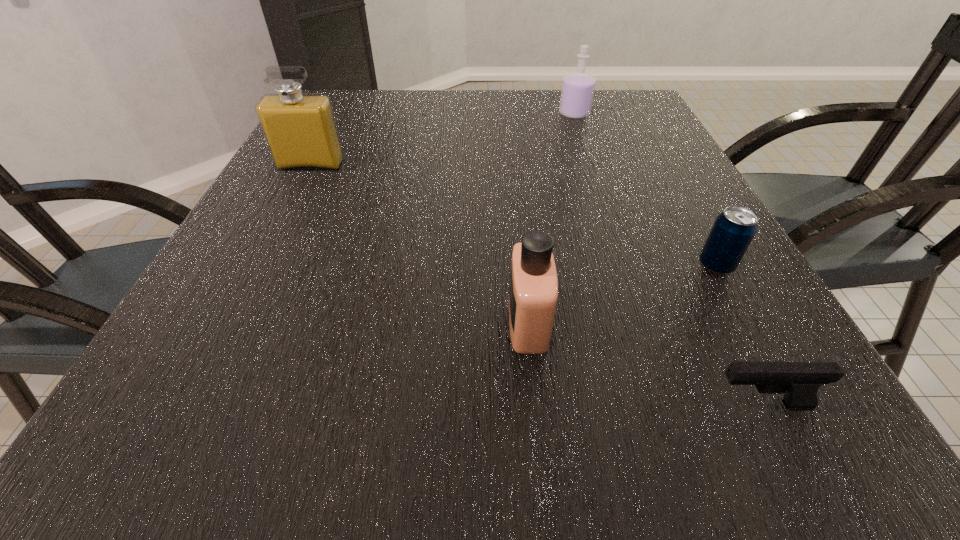
Locate an element on the screen. The image size is (960, 540). object situated at the near edge is located at coordinates (799, 381).

This screenshot has width=960, height=540. Find the location of `object that is at the left edge`. object that is at the left edge is located at coordinates (300, 129).

You are a GUI agent. You are given a task and a screenshot of the screen. Output one action in this format:
    pyautogui.click(x=<x>, y=<y>)
    Task: Click on the soda can positioned at the right edge
    
    Given the screenshot: What is the action you would take?
    pyautogui.click(x=733, y=230)

Find the location of `pistol present at the right edge`. pistol present at the right edge is located at coordinates (799, 381).

You are a GUI agent. You are given a task and a screenshot of the screen. Output one action in this format:
    pyautogui.click(x=<x>, y=<y>)
    Task: Click on the object present at the near right corner
    
    Given the screenshot: What is the action you would take?
    pyautogui.click(x=799, y=381)

Locate an element on the screen. This screenshot has width=960, height=540. free space at the far edge is located at coordinates pyautogui.click(x=447, y=121).

The width and height of the screenshot is (960, 540). I want to click on vacant space at the near edge of the desktop, so click(693, 457).

Image resolution: width=960 pixels, height=540 pixels. I want to click on free space at the left edge, so click(165, 387).

Image resolution: width=960 pixels, height=540 pixels. In the image, there is a desktop. Identify the location of vacant space at the right edge. (628, 190).

In the image, there is a desktop. Where is `vacant space at the far left corner`? vacant space at the far left corner is located at coordinates pos(368,106).